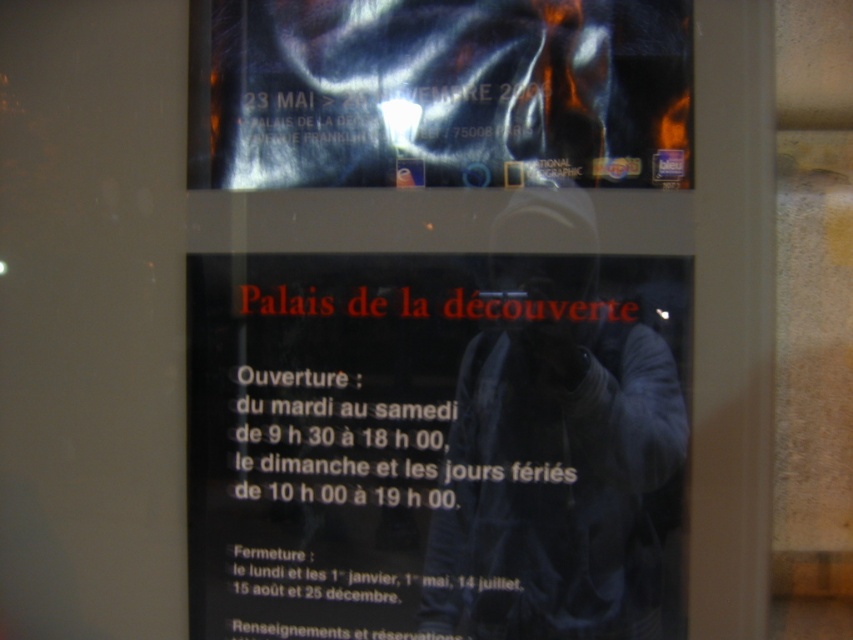
You are standing in front of a glass display case and see the black paper at center and the metallic reflective poster at upper center. Which object is closer to you?

The black paper at center is closer to you because it is further to the viewer than the metallic reflective poster at upper center.